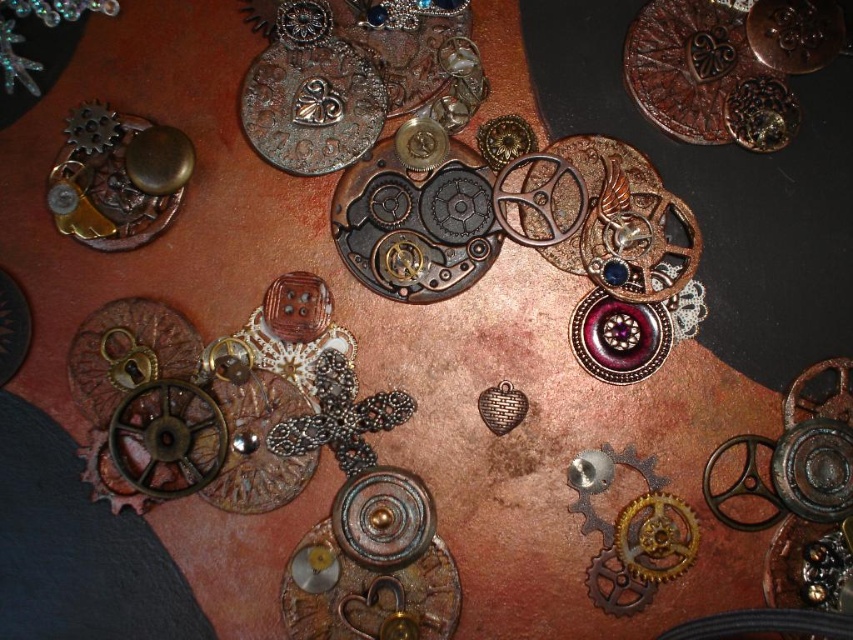
Is antique brass gear at center wider than matte gold gear at upper left?

Indeed, antique brass gear at center has a greater width compared to matte gold gear at upper left.

Which of these two, antique brass gear at center or matte gold gear at upper left, stands taller?

antique brass gear at center

Who is more distant from viewer, (317, 22) or (160, 204)?

The point (317, 22) is more distant.

You are a GUI agent. You are given a task and a screenshot of the screen. Output one action in this format:
    pyautogui.click(x=<x>, y=<y>)
    Task: Click on the antique brass gear at center
    The image size is (853, 640).
    Given the screenshot: What is the action you would take?
    [351, 74]

Find the location of a particular element. Image resolution: width=853 pixels, height=640 pixels. antique brass gear at center is located at coordinates (351, 74).

The image size is (853, 640). Find the location of `antique brass gear at center`. antique brass gear at center is located at coordinates (351, 74).

Is copper textured gear at upper right smaller than antique bronze heart at center?

No.

Between copper textured gear at upper right and antique bronze heart at center, which one is positioned higher?

copper textured gear at upper right is higher up.

What do you see at coordinates (724, 61) in the screenshot?
I see `copper textured gear at upper right` at bounding box center [724, 61].

Find the location of `copper textured gear at upper right`. copper textured gear at upper right is located at coordinates (724, 61).